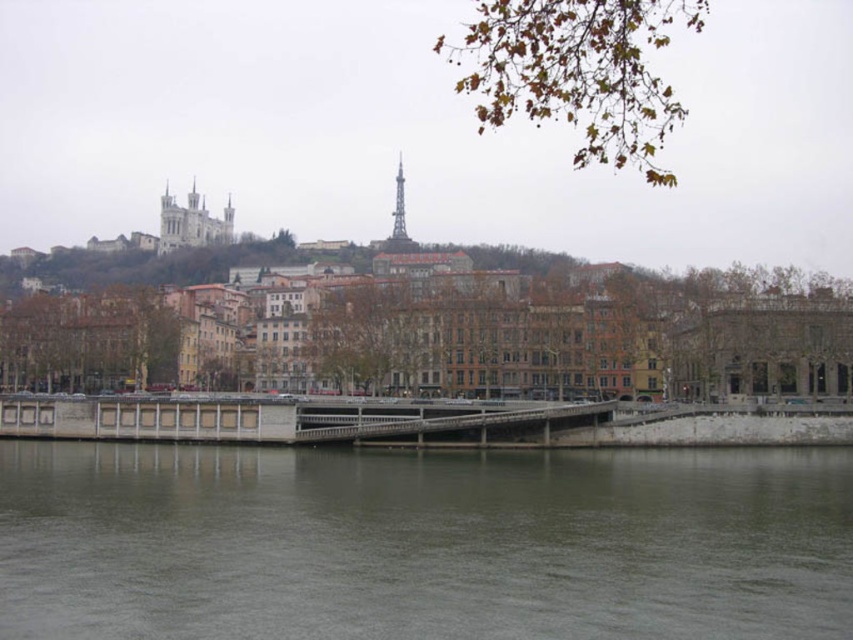
In the scene shown: Does gray concrete river at lower center have a greater width compared to concrete bridge at center?

Indeed, gray concrete river at lower center has a greater width compared to concrete bridge at center.

Which of these two, gray concrete river at lower center or concrete bridge at center, stands shorter?

Standing shorter between the two is gray concrete river at lower center.

Is point (463, 563) positioned behind point (4, 424)?

No, it is not.

I want to click on gray concrete river at lower center, so click(x=422, y=544).